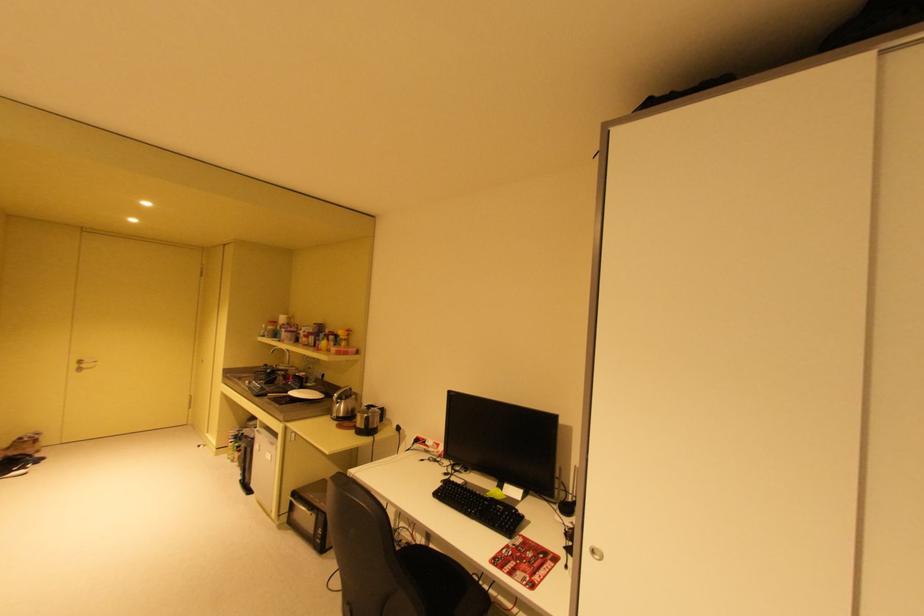
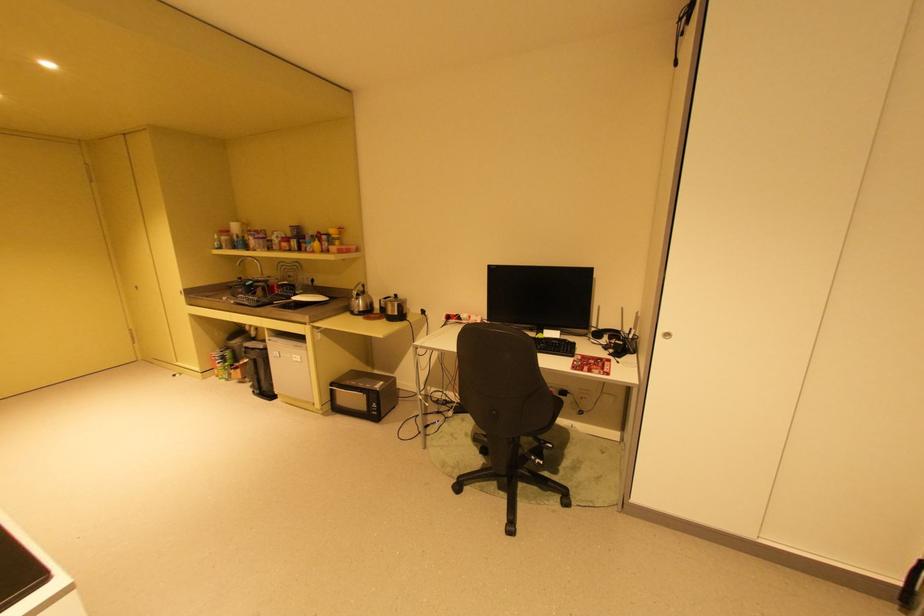
In the second image, find the point that corresponds to (371,427) in the first image.

(404, 314)